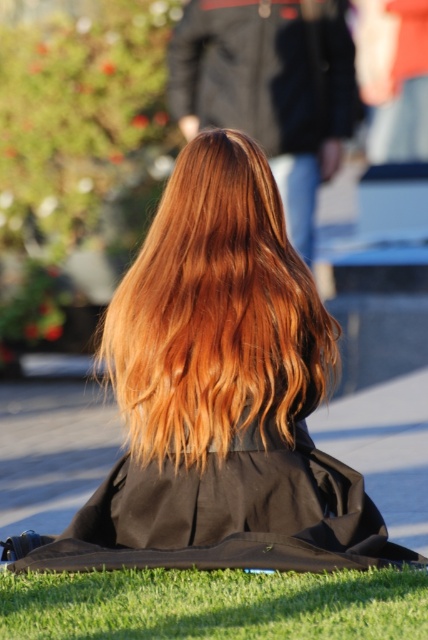
Between shiny brown hair at center and black matte robe at center, which one has more height?

With more height is shiny brown hair at center.

Can you confirm if shiny brown hair at center is positioned above black matte robe at center?

Yes, shiny brown hair at center is above black matte robe at center.

Measure the distance between point (174, 451) and camera.

Point (174, 451) and camera are 4.69 meters apart from each other.

The width and height of the screenshot is (428, 640). I want to click on shiny brown hair at center, so [x=219, y=396].

Is shiny brown hair at center behind green grass at lower center?

Yes, it is.

Can you confirm if shiny brown hair at center is thinner than green grass at lower center?

No, shiny brown hair at center is not thinner than green grass at lower center.

Which is behind, point (184, 305) or point (201, 598)?

The point (184, 305) is behind.

Find the location of `shiny brown hair at center`. shiny brown hair at center is located at coordinates (219, 396).

Is point (193, 346) closer to camera compared to point (234, 49)?

Yes, it is.

Is shiny brown hair at center to the left of shiny black robe at center from the viewer's perspective?

Correct, you'll find shiny brown hair at center to the left of shiny black robe at center.

Who is more distant from viewer, (x=282, y=348) or (x=282, y=116)?

Point (x=282, y=116)

At what (x,y) coordinates should I click in order to perform the action: click on shiny brown hair at center. Please return your answer as a coordinate pair (x, y). Image resolution: width=428 pixels, height=640 pixels. Looking at the image, I should click on (219, 396).